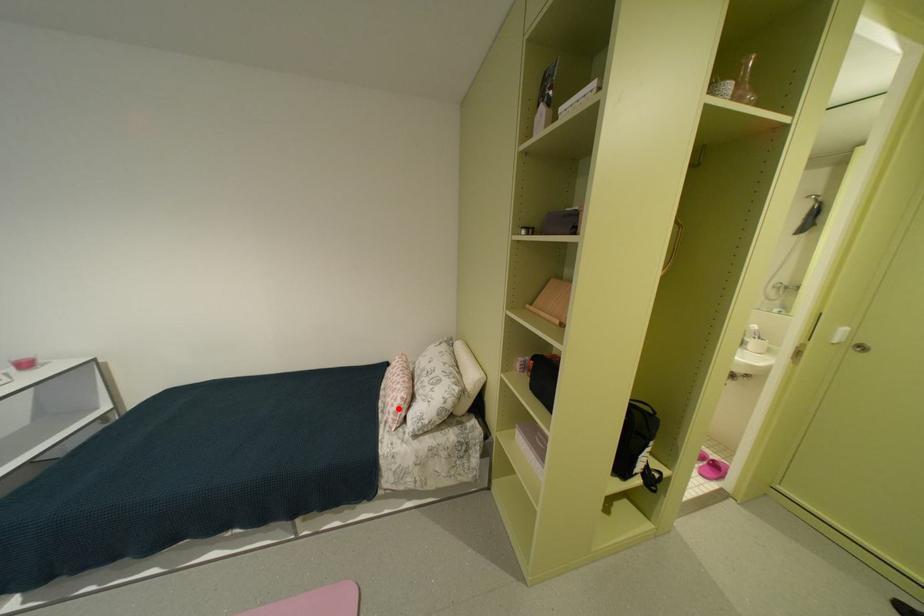
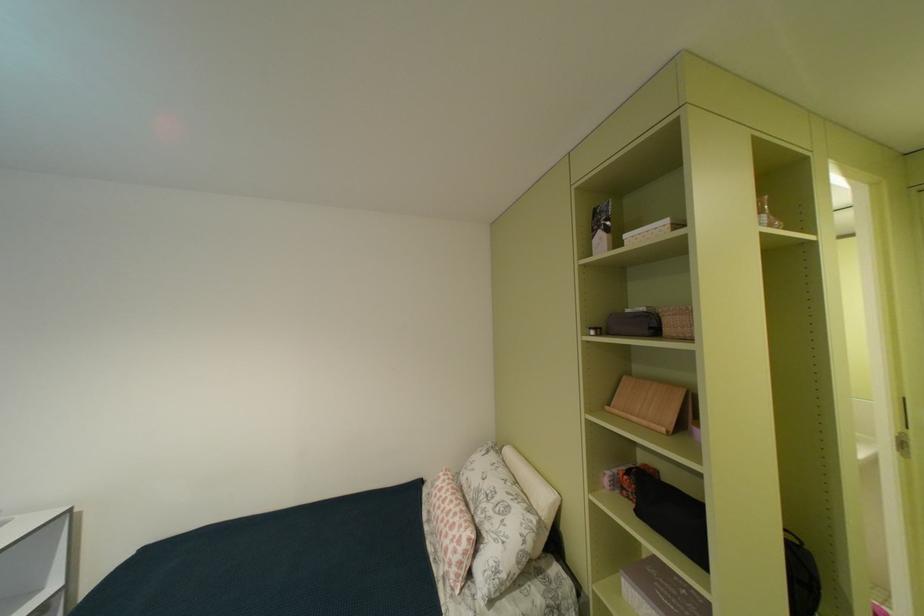
The point at the highlighted location is marked in the first image. Where is the corresponding point in the second image?

(458, 556)